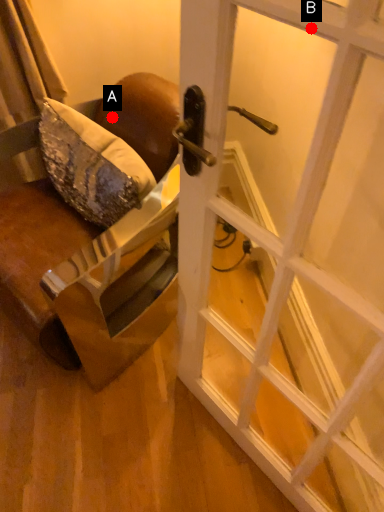
Question: Two points are circled on the image, labeled by A and B beside each circle. Which of the following is the farthest from the observer?

Choices:
 (A) A is further
 (B) B is further

Answer: (A)